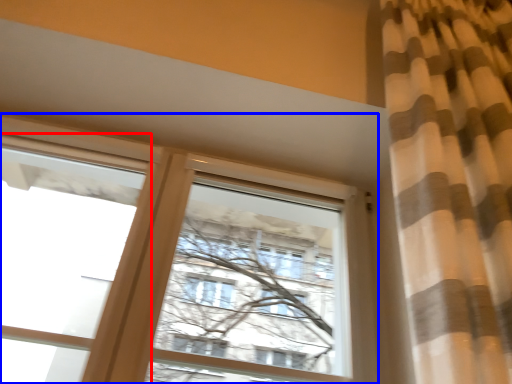
Question: Which point is closer to the camera, window (highlighted by a red box) or window (highlighted by a blue box)?

Choices:
 (A) window
 (B) window

Answer: (A)